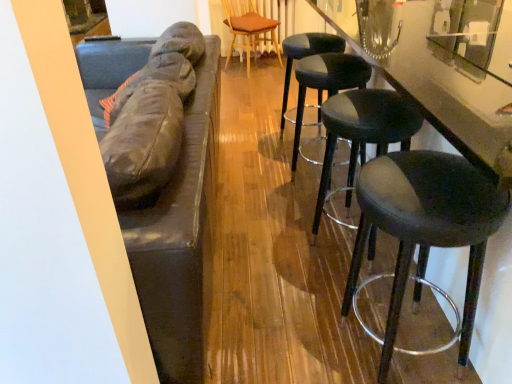
Describe the element at coordinates (441, 70) in the screenshot. I see `glossy black counter at right` at that location.

Measure the distance between black leather stool at center, arranged as the 1th stool when viewed from the back, and camera.

black leather stool at center, arranged as the 1th stool when viewed from the back, and camera are 2.31 meters apart from each other.

What is the approximate height of black leather stool at center, arranged as the 1th stool when viewed from the back?

black leather stool at center, arranged as the 1th stool when viewed from the back, is 28.26 inches in height.

Identify the location of black leather stool at right, which is the third stool from front to back. (326, 81).

You are a GUI agent. You are given a task and a screenshot of the screen. Output one action in this format:
    pyautogui.click(x=<x>, y=<y>)
    Task: Click on the wooden textured chair at center
    
    Given the screenshot: What is the action you would take?
    pyautogui.click(x=249, y=28)

Image resolution: width=512 pixels, height=384 pixels. Identify the location of matte black stool at right, the second stool in the front-to-back sequence. (362, 132).

Is wooden textured chair at center looking in the opposite direction of black leather stool at center, the 4th stool when ordered from front to back?

No.

Are wooden textured chair at center and black leather stool at center, the 4th stool when ordered from front to back, making contact?

No, wooden textured chair at center is not beside black leather stool at center, the 4th stool when ordered from front to back.

Between wooden textured chair at center and black leather stool at center, the 4th stool when ordered from front to back, which one has more height?

Standing taller between the two is wooden textured chair at center.

Would you say wooden textured chair at center is inside or outside black leather stool at center, the 4th stool when ordered from front to back?

wooden textured chair at center lies outside black leather stool at center, the 4th stool when ordered from front to back.

In terms of height, does glossy black counter at right look taller or shorter compared to black leather stool at right, marked as the first stool in a front-to-back arrangement?

glossy black counter at right is taller than black leather stool at right, marked as the first stool in a front-to-back arrangement.

Is point (477, 352) less distant than point (415, 351)?

Yes, it is.

Which object is positioned more to the left, glossy black counter at right or black leather stool at right, which is the fourth stool from back to front?

black leather stool at right, which is the fourth stool from back to front, is more to the left.

Is glossy black counter at right not near black leather stool at right, which is the fourth stool from back to front?

They are positioned close to each other.

From the image's perspective, is black leather stool at right, which is the fourth stool from back to front, positioned above or below glossy black counter at right?

Based on their image positions, black leather stool at right, which is the fourth stool from back to front, is located beneath glossy black counter at right.

Is black leather stool at right, which is the fourth stool from back to front, positioned beyond the bounds of glossy black counter at right?

No, black leather stool at right, which is the fourth stool from back to front, is not outside of glossy black counter at right.

Considering the sizes of objects black leather stool at right, which is the fourth stool from back to front, and glossy black counter at right in the image provided, who is shorter, black leather stool at right, which is the fourth stool from back to front, or glossy black counter at right?

black leather stool at right, which is the fourth stool from back to front.

Looking at this image, which object is wider, black leather stool at right, which is the fourth stool from back to front, or glossy black counter at right?

Wider between the two is glossy black counter at right.

From the image's perspective, between black leather stool at right, marked as the first stool in a front-to-back arrangement, and black leather stool at center, arranged as the 1th stool when viewed from the back, which one is located above?

black leather stool at center, arranged as the 1th stool when viewed from the back.

Does point (468, 222) come closer to viewer compared to point (284, 39)?

Yes, it is.

Between black leather stool at right, marked as the first stool in a front-to-back arrangement, and black leather stool at center, the 4th stool when ordered from front to back, which one has more height?

black leather stool at right, marked as the first stool in a front-to-back arrangement.

Is matte black stool at right, which is the third stool from back to front, bigger than black leather stool at right, which is the third stool from front to back?

No.

From a real-world perspective, which object rests below the other?

From a 3D spatial view, matte black stool at right, the second stool in the front-to-back sequence, is below.

From the image's perspective, is matte black stool at right, the second stool in the front-to-back sequence, beneath black leather stool at right, which is the third stool from front to back?

Indeed, from the image's perspective, matte black stool at right, the second stool in the front-to-back sequence, is shown beneath black leather stool at right, which is the third stool from front to back.

Is matte black stool at right, the second stool in the front-to-back sequence, taller than black leather stool at right, which is the fourth stool from back to front?

In fact, matte black stool at right, the second stool in the front-to-back sequence, may be shorter than black leather stool at right, which is the fourth stool from back to front.

Looking at this image, how distant is matte black stool at right, the second stool in the front-to-back sequence, from black leather stool at right, which is the fourth stool from back to front?

matte black stool at right, the second stool in the front-to-back sequence, is 16.92 inches away from black leather stool at right, which is the fourth stool from back to front.

Is matte black stool at right, the second stool in the front-to-back sequence, positioned behind black leather stool at right, which is the fourth stool from back to front?

Yes, matte black stool at right, the second stool in the front-to-back sequence, is behind black leather stool at right, which is the fourth stool from back to front.

From a real-world perspective, is matte black stool at right, which is the third stool from back to front, on black leather stool at right, marked as the first stool in a front-to-back arrangement?

No, from a real-world perspective, matte black stool at right, which is the third stool from back to front, is not above black leather stool at right, marked as the first stool in a front-to-back arrangement.

Is wooden textured chair at center surrounded by black leather stool at right, the 2th stool in the back-to-front sequence?

That's incorrect, wooden textured chair at center is not inside black leather stool at right, the 2th stool in the back-to-front sequence.

What's the angular difference between black leather stool at right, which is the third stool from front to back, and wooden textured chair at center's facing directions?

The angle between the facing direction of black leather stool at right, which is the third stool from front to back, and the facing direction of wooden textured chair at center is 51.5 degrees.

Starting from the wooden textured chair at center, which stool is the 2nd one in front? Please provide its 2D coordinates.

[(326, 81)]

Would you consider black leather stool at right, which is the third stool from front to back, to be distant from wooden textured chair at center?

black leather stool at right, which is the third stool from front to back, is far away from wooden textured chair at center.

Where is `chair on the left side of black leather stool at center, the 4th stool when ordered from front to back`? chair on the left side of black leather stool at center, the 4th stool when ordered from front to back is located at coordinates (249, 28).

From the image's perspective, starting from the glossy black counter at right, which stool is the 2nd one below? Please provide its 2D coordinates.

[(424, 232)]

Considering their positions, is black leather stool at center, the 4th stool when ordered from front to back, positioned closer to black leather stool at right, which is the fourth stool from back to front, than glossy black counter at right?

The object closer to black leather stool at right, which is the fourth stool from back to front, is glossy black counter at right.

Which object lies nearer to the anchor point wooden textured chair at center, black leather stool at center, the 4th stool when ordered from front to back, or glossy black counter at right?

Among the two, black leather stool at center, the 4th stool when ordered from front to back, is located nearer to wooden textured chair at center.

Considering their positions, is black leather stool at right, which is the third stool from front to back, positioned closer to black leather stool at center, the 4th stool when ordered from front to back, than matte black stool at right, which is the third stool from back to front?

black leather stool at right, which is the third stool from front to back, is positioned closer to the anchor black leather stool at center, the 4th stool when ordered from front to back.

In the scene shown: Based on their spatial positions, is wooden textured chair at center or matte black stool at right, which is the third stool from back to front, further from black leather stool at right, the 2th stool in the back-to-front sequence?

Based on the image, wooden textured chair at center appears to be further to black leather stool at right, the 2th stool in the back-to-front sequence.

Based on their spatial positions, is wooden textured chair at center or matte black stool at right, which is the third stool from back to front, closer to glossy black counter at right?

matte black stool at right, which is the third stool from back to front, is closer to glossy black counter at right.

From the image, which object appears to be farther from black leather stool at right, marked as the first stool in a front-to-back arrangement, black leather stool at center, the 4th stool when ordered from front to back, or wooden textured chair at center?

wooden textured chair at center lies further to black leather stool at right, marked as the first stool in a front-to-back arrangement, than the other object.

From the image, which object appears to be farther from glossy black counter at right, black leather stool at right, marked as the first stool in a front-to-back arrangement, or black leather stool at right, the 2th stool in the back-to-front sequence?

The object further to glossy black counter at right is black leather stool at right, the 2th stool in the back-to-front sequence.

When comparing their distances from black leather stool at right, which is the third stool from front to back, does wooden textured chair at center or black leather stool at right, marked as the first stool in a front-to-back arrangement, seem closer?

Based on the image, black leather stool at right, marked as the first stool in a front-to-back arrangement, appears to be nearer to black leather stool at right, which is the third stool from front to back.

Where is `stool between black leather stool at right, the 2th stool in the back-to-front sequence, and wooden textured chair at center in the front-back direction`? The height and width of the screenshot is (384, 512). stool between black leather stool at right, the 2th stool in the back-to-front sequence, and wooden textured chair at center in the front-back direction is located at coordinates tap(306, 55).

Identify the location of stool positioned between glossy black counter at right and matte black stool at right, the second stool in the front-to-back sequence, from near to far. (424, 232).

The image size is (512, 384). Find the location of `stool between black leather stool at right, marked as the first stool in a front-to-back arrangement, and black leather stool at right, which is the third stool from front to back, along the z-axis`. stool between black leather stool at right, marked as the first stool in a front-to-back arrangement, and black leather stool at right, which is the third stool from front to back, along the z-axis is located at coordinates (362, 132).

You are a GUI agent. You are given a task and a screenshot of the screen. Output one action in this format:
    pyautogui.click(x=<x>, y=<y>)
    Task: Click on the stool between matte black stool at right, the second stool in the front-to-back sequence, and black leather stool at center, the 4th stool when ordered from front to back, from front to back
    The image size is (512, 384).
    Given the screenshot: What is the action you would take?
    pyautogui.click(x=326, y=81)